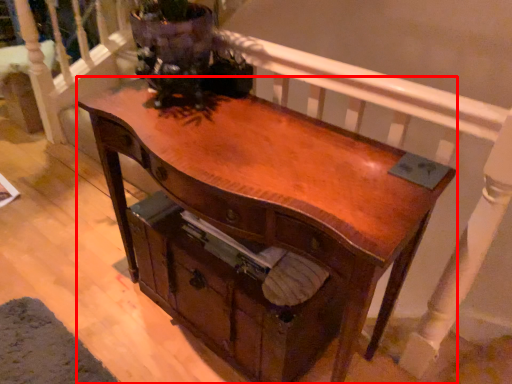
Question: From the image's perspective, what is the correct spatial relationship of desk (annotated by the red box) in relation to drawer?

Choices:
 (A) above
 (B) below

Answer: (A)